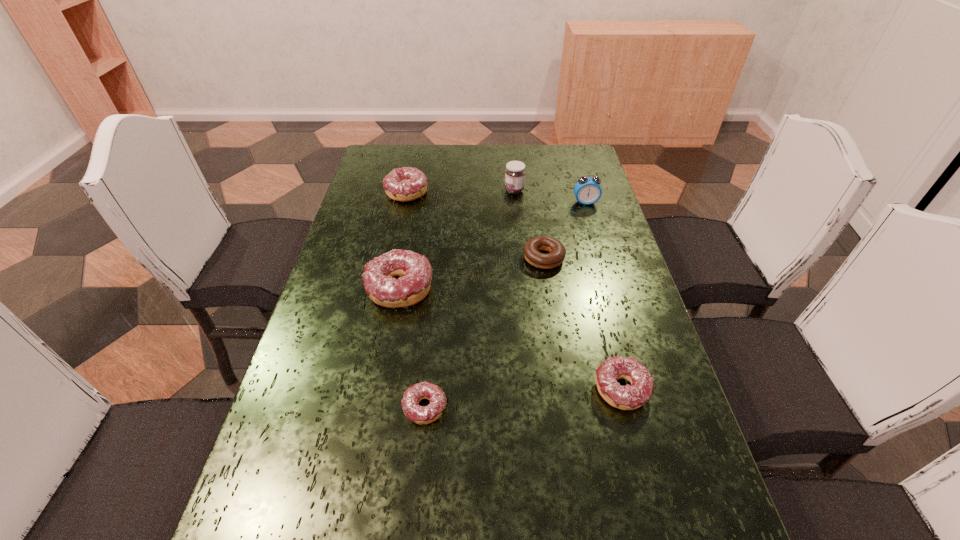
The height and width of the screenshot is (540, 960). In order to click on doughnut at the right edge in this screenshot , I will do `click(629, 397)`.

Image resolution: width=960 pixels, height=540 pixels. Find the location of `vacant region at the far edge of the desktop`. vacant region at the far edge of the desktop is located at coordinates (490, 167).

The height and width of the screenshot is (540, 960). I want to click on free space at the left edge, so click(x=320, y=375).

Where is `vacant space at the right edge of the desktop`? vacant space at the right edge of the desktop is located at coordinates click(x=562, y=200).

At what (x,y) coordinates should I click in order to perform the action: click on vacant area that lies between the rightmost doughnut and the second doughnut from right to left. Please return your answer as a coordinate pair (x, y). The image size is (960, 540). Looking at the image, I should click on (583, 324).

This screenshot has height=540, width=960. Find the location of `empty space between the alarm clock and the brown doughnut`. empty space between the alarm clock and the brown doughnut is located at coordinates (564, 230).

This screenshot has height=540, width=960. I want to click on free point between the smallest pink doughnut and the third nearest pink doughnut, so tap(413, 348).

The image size is (960, 540). I want to click on empty space that is in between the jam and the third nearest pink doughnut, so click(457, 240).

Find the location of `free space that is in between the jam and the brown doughnut`. free space that is in between the jam and the brown doughnut is located at coordinates (529, 224).

Identify which object is the fifth nearest to the alarm clock. Please provide its 2D coordinates. Your answer should be formatted as a tuple, i.e. [(x, y)], where the tuple contains the x and y coordinates of a point satisfying the conditions above.

[(629, 397)]